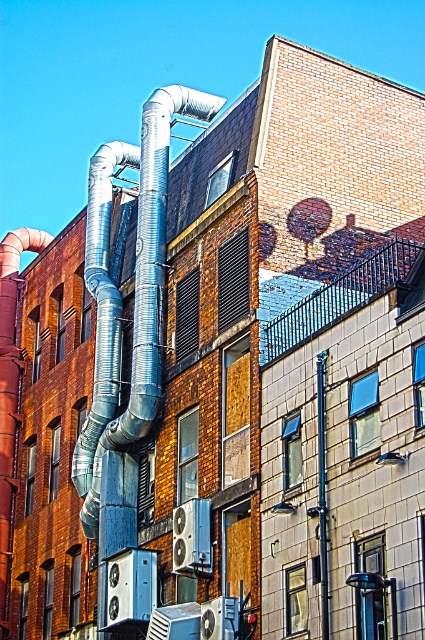
Between point (105, 336) and point (323, 570), which one is positioned in front?

Point (323, 570) is in front.

Who is lower down, silver metallic pipes at left or brushed metal pole at center?

Positioned lower is brushed metal pole at center.

Measure the distance between point (x=102, y=392) and camera.

62.55 meters

Locate an element on the screen. The width and height of the screenshot is (425, 640). silver metallic pipes at left is located at coordinates (101, 324).